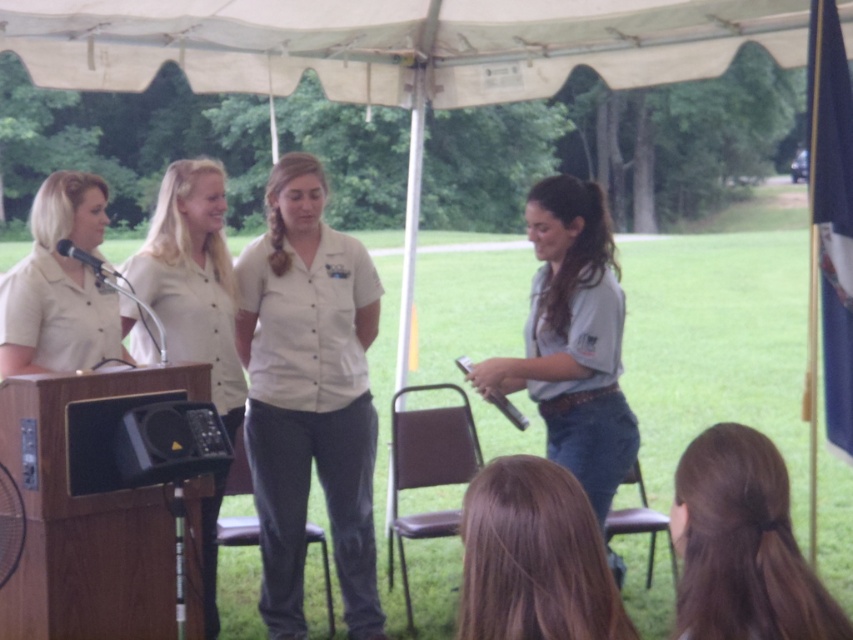
Does white cotton shirt at center have a lesser height compared to matte white shirt at left?

Incorrect, white cotton shirt at center's height does not fall short of matte white shirt at left's.

Between point (337, 410) and point (93, 358), which one is positioned behind?

The point (337, 410) is more distant.

In order to click on white cotton shirt at center in this screenshot , I will do `click(310, 419)`.

Is brown hair at lower right positioned at the back of matte white shirt at left?

No.

Does brown hair at lower right have a larger size compared to matte white shirt at left?

No, brown hair at lower right is not bigger than matte white shirt at left.

Is point (728, 600) positioned before point (4, 273)?

That is True.

This screenshot has height=640, width=853. In order to click on brown hair at lower right in this screenshot , I will do `click(741, 545)`.

Who is more forward, (187,3) or (294,547)?

Point (294,547) is in front.

Is point (340, 38) more distant than point (263, 484)?

Yes, point (340, 38) is farther from viewer.

Image resolution: width=853 pixels, height=640 pixels. In order to click on white fabric canopy at upper center in this screenshot , I will do `click(393, 44)`.